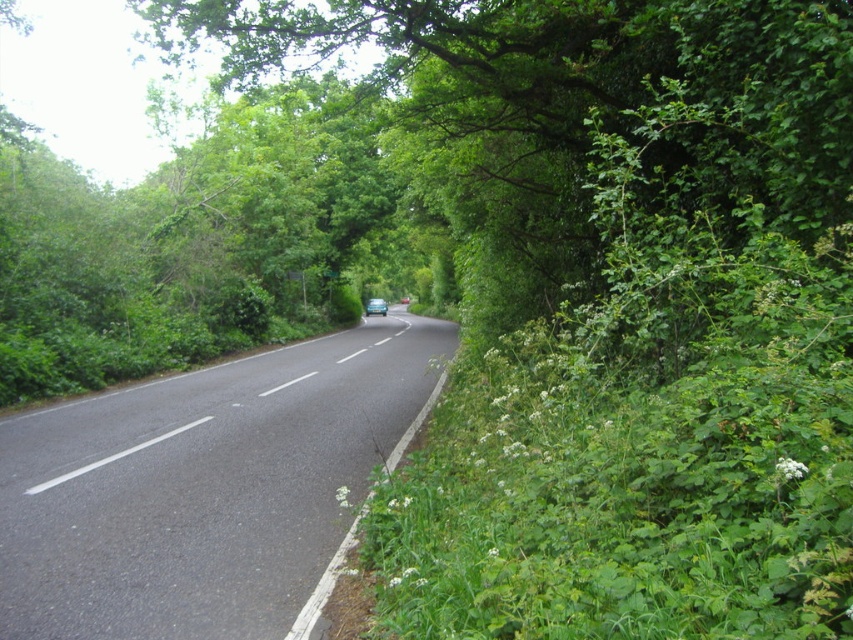
Question: Does black asphalt road at center have a smaller size compared to blue metallic car at center?

Choices:
 (A) no
 (B) yes

Answer: (A)

Question: Can you confirm if black asphalt road at center is positioned to the left of blue metallic car at center?

Choices:
 (A) yes
 (B) no

Answer: (B)

Question: Among these points, which one is farthest from the camera?

Choices:
 (A) (157, 492)
 (B) (381, 301)

Answer: (B)

Question: Does black asphalt road at center appear over blue metallic car at center?

Choices:
 (A) yes
 (B) no

Answer: (B)